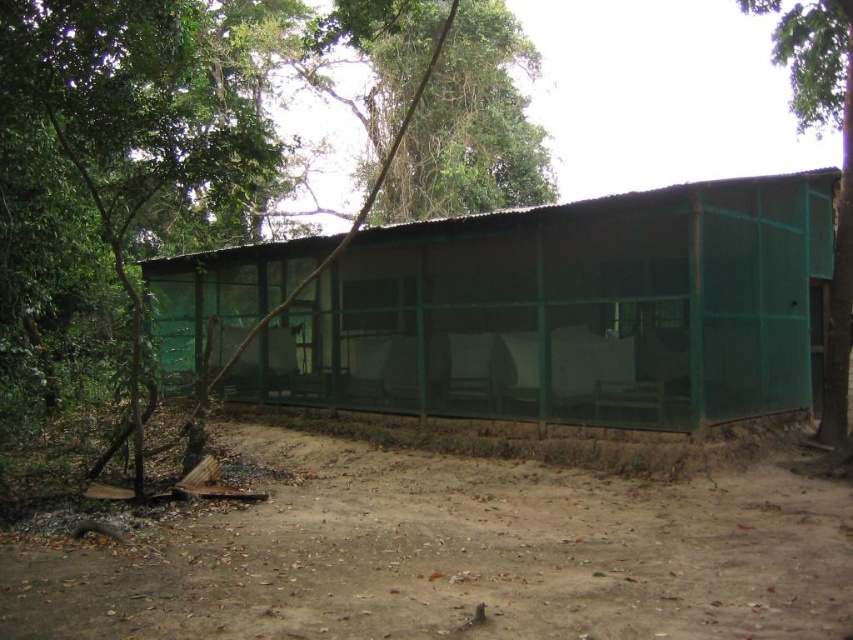
Question: Which of the following is the closest to the observer?

Choices:
 (A) green mesh screen at center
 (B) green mesh hut at center
 (C) brown dirt track at lower center

Answer: (C)

Question: Is green mesh screen at center further to the viewer compared to green mesh fence at right?

Choices:
 (A) yes
 (B) no

Answer: (B)

Question: Among these objects, which one is nearest to the camera?

Choices:
 (A) brown dirt track at lower center
 (B) green mesh screen at center

Answer: (A)

Question: Is brown dirt track at lower center thinner than green mesh fence at right?

Choices:
 (A) yes
 (B) no

Answer: (A)

Question: Which of these objects is positioned farthest from the brown dirt track at lower center?

Choices:
 (A) green mesh hut at center
 (B) green mesh screen at center
 (C) green mesh fence at right

Answer: (B)

Question: Where is green mesh hut at center located in relation to green mesh screen at center in the image?

Choices:
 (A) below
 (B) above

Answer: (A)